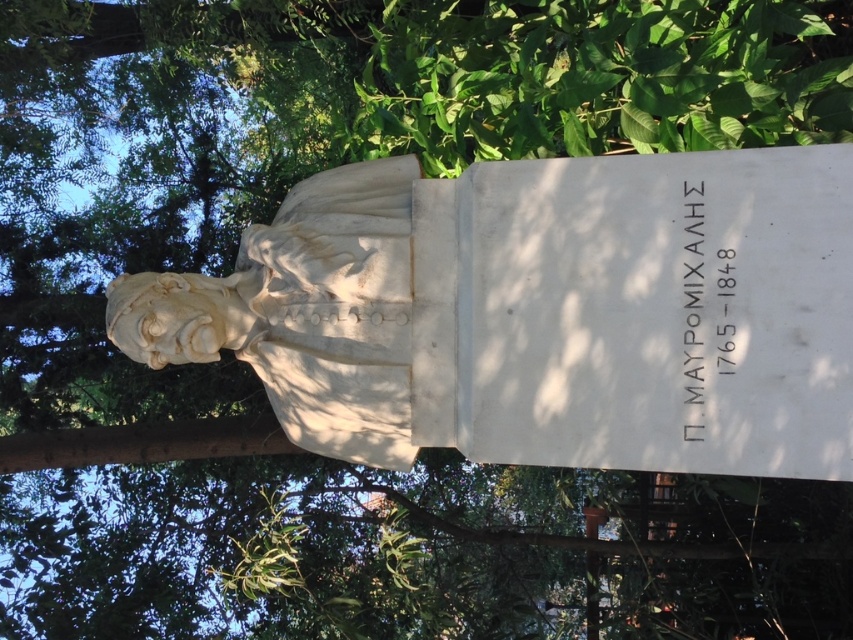
You are a visitor to the park and want to read the inscription on the white stone inscription at center. However, the white marble bust at left is blocking your view. Can you walk around the bust to see the inscription?

The white marble bust at left is positioned over the white stone inscription at center, so you can walk around the bust to get a clear view of the inscription.

From the picture: You are standing in front of the marble bust sculpture in the park. You notice two points marked on the sculpture. One is at coordinate point [807,428] and the other at point [701,314]. Which point is closer to you?

Point [807,428] is closer to the viewer than point [701,314].